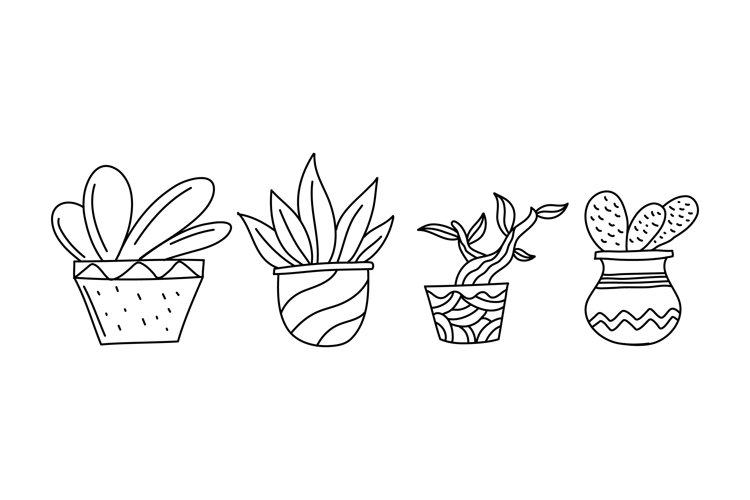
The image size is (750, 500). What are the coordinates of `fourth vase` in the screenshot? It's located at (630, 289).